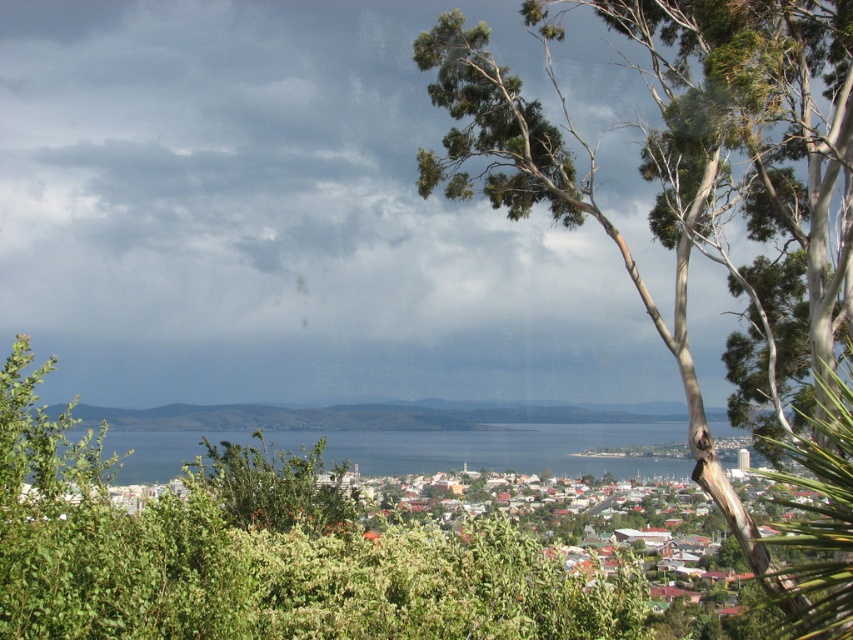
From the picture: Which of these two, blue water at center or green leafy bush at center, stands taller?

With more height is blue water at center.

Is blue water at center shorter than green leafy bush at center?

No, blue water at center is not shorter than green leafy bush at center.

Who is more forward, (556, 474) or (225, 506)?

Point (225, 506) is in front.

The height and width of the screenshot is (640, 853). I want to click on blue water at center, so click(515, 449).

Where is `green textured tree at upper right`? The image size is (853, 640). green textured tree at upper right is located at coordinates (703, 209).

Is green textured tree at upper right thinner than blue water at center?

Yes, green textured tree at upper right is thinner than blue water at center.

Between point (753, 356) and point (352, 435), which one is positioned in front?

Positioned in front is point (753, 356).

Find the location of `green textured tree at upper right`. green textured tree at upper right is located at coordinates (703, 209).

Is green textured tree at upper right thinner than green leafy bush at center?

Incorrect, green textured tree at upper right's width is not less than green leafy bush at center's.

Can you confirm if green textured tree at upper right is smaller than green leafy bush at center?

No.

Is point (799, 621) farther from viewer compared to point (334, 483)?

No, it is in front of (334, 483).

Locate an element on the screen. green textured tree at upper right is located at coordinates (703, 209).